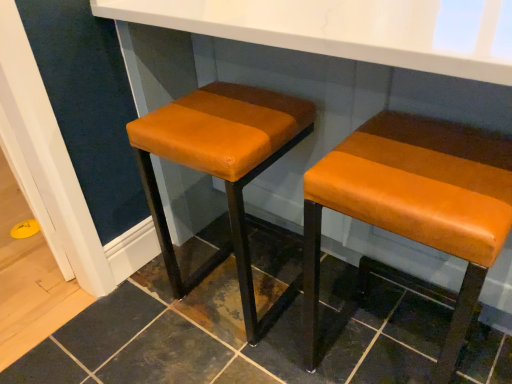
At what (x,y) coordinates should I click in order to perform the action: click on free region on the left part of orange leather stool at center, which appears as the first stool when viewed from the left. Please return your answer as a coordinate pair (x, y). This screenshot has width=512, height=384. Looking at the image, I should click on (139, 316).